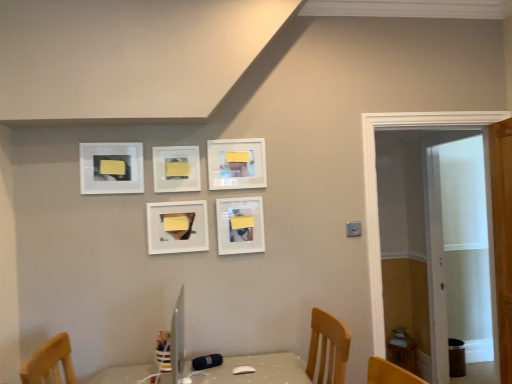
Question: Can you confirm if matte white picture frame at center, placed as the 5th picture frame when sorted from left to right, is shorter than white wooden door at right?

Choices:
 (A) no
 (B) yes

Answer: (B)

Question: Is matte white picture frame at center, placed as the 5th picture frame when sorted from left to right, aimed at white wooden door at right?

Choices:
 (A) yes
 (B) no

Answer: (B)

Question: From the image's perspective, would you say matte white picture frame at center, which appears as the 1th picture frame when viewed from the right, is positioned over white wooden door at right?

Choices:
 (A) no
 (B) yes

Answer: (B)

Question: Is matte white picture frame at center, which appears as the 1th picture frame when viewed from the right, at the right side of white wooden door at right?

Choices:
 (A) yes
 (B) no

Answer: (B)

Question: Would you say matte white picture frame at center, placed as the 5th picture frame when sorted from left to right, contains white wooden door at right?

Choices:
 (A) yes
 (B) no

Answer: (B)

Question: From the image's perspective, is yellow matte picture frame at center, the 2th picture frame positioned from the left, above or below matte white picture frame at center, arranged as the 3th picture frame when viewed from the left?

Choices:
 (A) below
 (B) above

Answer: (B)

Question: From a real-world perspective, is yellow matte picture frame at center, the fourth picture frame in the right-to-left sequence, positioned above or below matte white picture frame at center, marked as the third picture frame in a right-to-left arrangement?

Choices:
 (A) below
 (B) above

Answer: (B)

Question: In the image, is yellow matte picture frame at center, the 2th picture frame positioned from the left, positioned in front of or behind matte white picture frame at center, arranged as the 3th picture frame when viewed from the left?

Choices:
 (A) front
 (B) behind

Answer: (B)

Question: Does point (184, 188) appear closer or farther from the camera than point (179, 230)?

Choices:
 (A) closer
 (B) farther

Answer: (B)

Question: From the image's perspective, is matte white picture frame at upper center, which is counted as the second picture frame, starting from the right, above or below matte white picture frame at center, marked as the third picture frame in a right-to-left arrangement?

Choices:
 (A) above
 (B) below

Answer: (A)

Question: Is matte white picture frame at upper center, which is counted as the second picture frame, starting from the right, inside the boundaries of matte white picture frame at center, marked as the third picture frame in a right-to-left arrangement, or outside?

Choices:
 (A) inside
 (B) outside

Answer: (B)

Question: Is point (247, 147) positioned closer to the camera than point (194, 213)?

Choices:
 (A) farther
 (B) closer

Answer: (A)

Question: Considering the positions of matte white picture frame at upper center, acting as the 4th picture frame starting from the left, and matte white picture frame at center, marked as the third picture frame in a right-to-left arrangement, in the image, is matte white picture frame at upper center, acting as the 4th picture frame starting from the left, taller or shorter than matte white picture frame at center, marked as the third picture frame in a right-to-left arrangement,?

Choices:
 (A) short
 (B) tall

Answer: (B)

Question: Based on their positions, is matte white picture frame at center, which appears as the 1th picture frame when viewed from the right, located to the left or right of matte white picture frame at center, arranged as the 3th picture frame when viewed from the left?

Choices:
 (A) left
 (B) right

Answer: (B)

Question: From a real-world perspective, is matte white picture frame at center, placed as the 5th picture frame when sorted from left to right, positioned above or below matte white picture frame at center, arranged as the 3th picture frame when viewed from the left?

Choices:
 (A) below
 (B) above

Answer: (A)